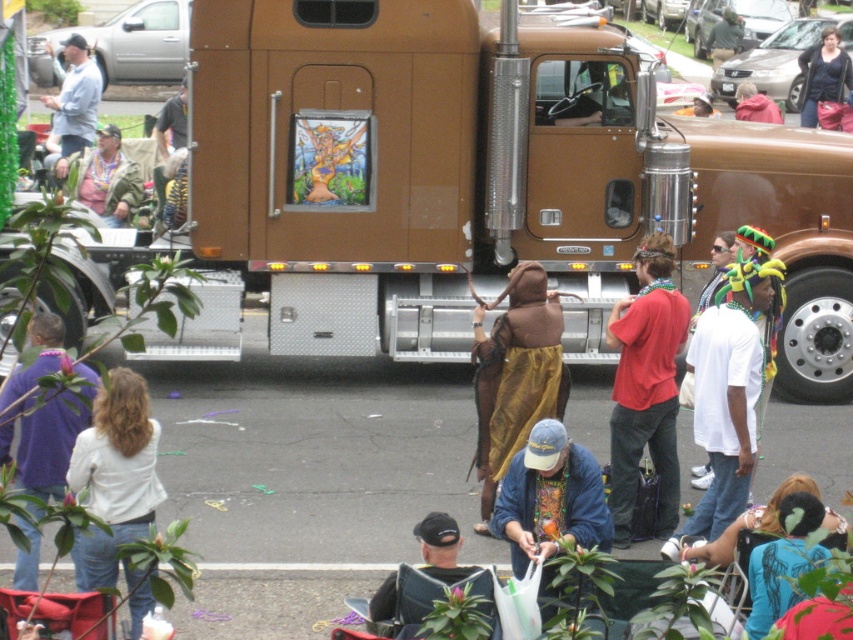
Question: Estimate the real-world distances between objects in this image. Which object is closer to the dark blue sweater at center?

Choices:
 (A) brown fabric at center
 (B) dark blue baseball cap at center
 (C) white fabric jacket at lower left

Answer: (A)

Question: Is blue t-shirt at lower right bigger than light blue denim jacket at upper left?

Choices:
 (A) yes
 (B) no

Answer: (B)

Question: Which point is closer to the camera?

Choices:
 (A) (793, 550)
 (B) (743, 106)
 (C) (289, 52)
 (D) (33, 417)

Answer: (A)

Question: Is white cotton shirt at center-right positioned in front of brushed metal jacket at upper left?

Choices:
 (A) no
 (B) yes

Answer: (B)

Question: Which object appears farthest from the camera in this image?

Choices:
 (A) blue t-shirt at lower right
 (B) brushed metal jacket at upper left

Answer: (B)

Question: Is brown metallic trailer truck at center closer to the viewer compared to blue t-shirt at lower right?

Choices:
 (A) yes
 (B) no

Answer: (B)